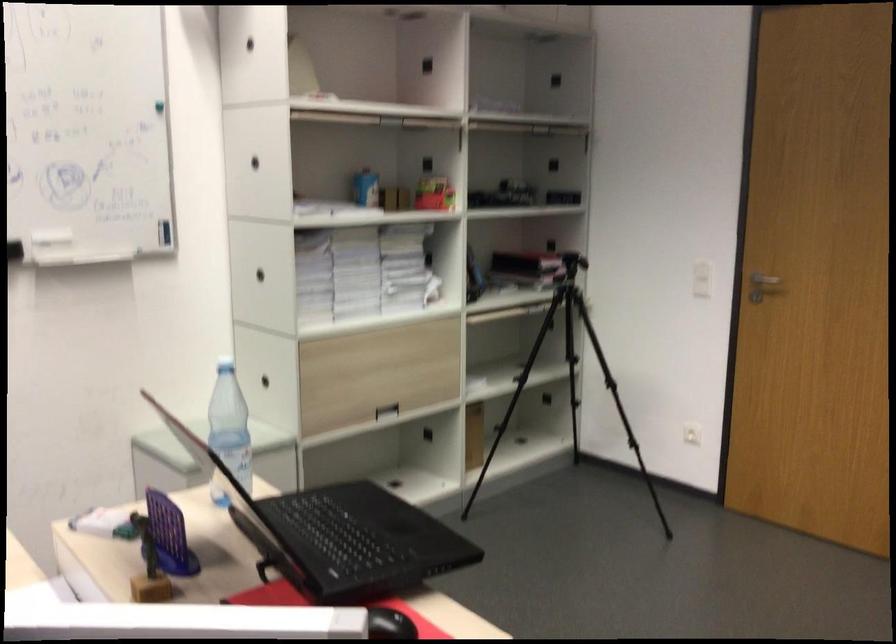
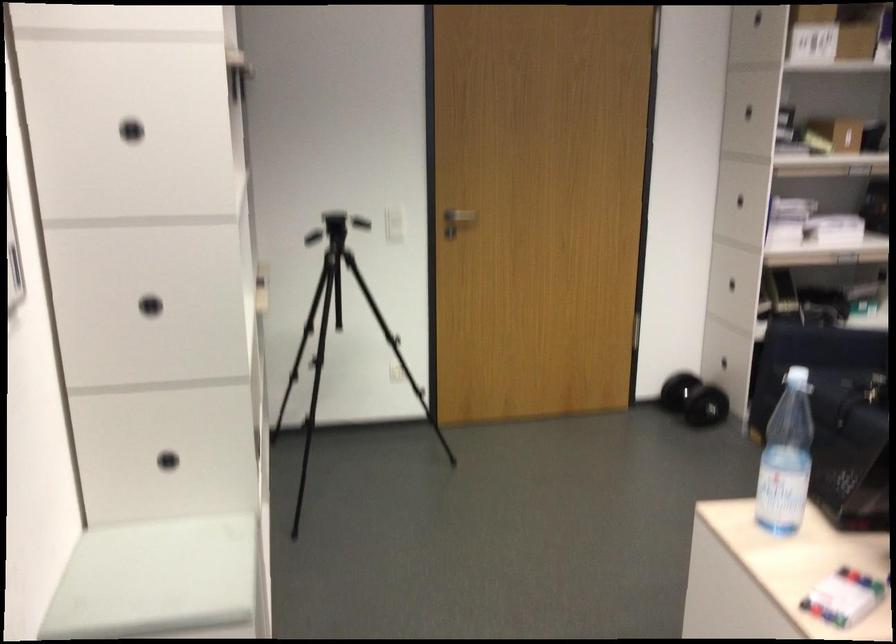
Locate, in the second image, the point that corresponds to point (293, 279) in the first image.

(150, 305)